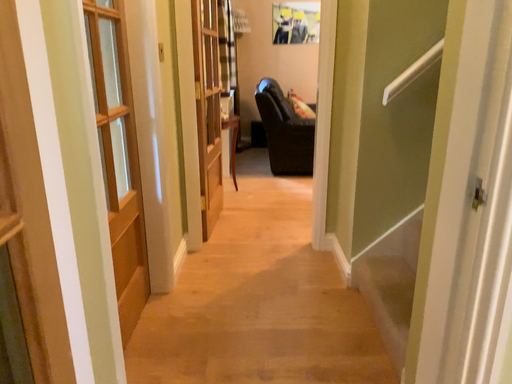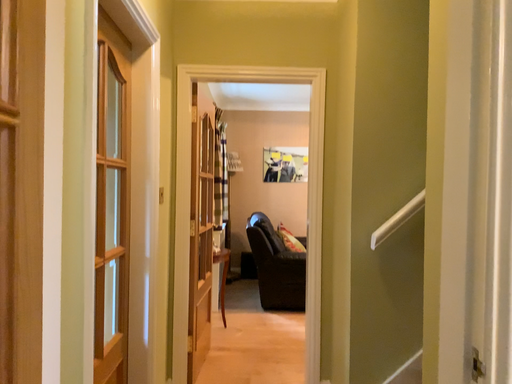
Question: Which way did the camera rotate in the video?

Choices:
 (A) rotated upward
 (B) rotated downward

Answer: (A)